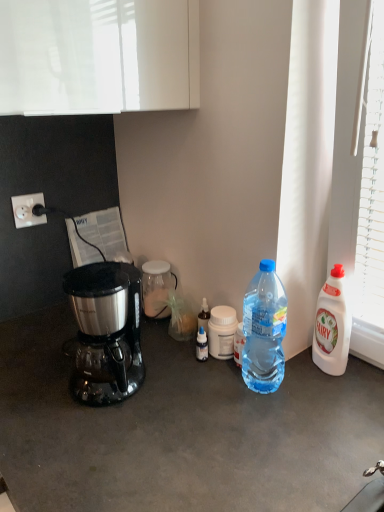
At what (x,y) coordinates should I click in order to perform the action: click on white plastic bottle at center, acting as the second bottle starting from the left. Please return your answer as a coordinate pair (x, y). Looking at the image, I should click on (222, 332).

From the image's perspective, between white plastic power outlet at left and transparent glass jar at center, positioned as the third bottle in right-to-left order, who is located below?

From the image's view, transparent glass jar at center, positioned as the third bottle in right-to-left order, is below.

In the image, is white plastic power outlet at left positioned in front of or behind transparent glass jar at center, the third bottle in the front-to-back sequence?

white plastic power outlet at left is in front of transparent glass jar at center, the third bottle in the front-to-back sequence.

This screenshot has width=384, height=512. Find the location of `the 1st bottle to the right of the white plastic power outlet at left, counting from the anchor's position`. the 1st bottle to the right of the white plastic power outlet at left, counting from the anchor's position is located at coordinates (157, 287).

Which of these two, white plastic bottle at center, acting as the second bottle starting from the left, or transparent glass jar at center, which appears as the 1th bottle when viewed from the left, stands taller?

Standing taller between the two is transparent glass jar at center, which appears as the 1th bottle when viewed from the left.

Is white plastic bottle at center, acting as the second bottle starting from the left, thinner than transparent glass jar at center, the third bottle in the front-to-back sequence?

Correct, the width of white plastic bottle at center, acting as the second bottle starting from the left, is less than that of transparent glass jar at center, the third bottle in the front-to-back sequence.

From the image's perspective, count 2nd bottles downward from the transparent glass jar at center, which appears as the first bottle when viewed from the back, and point to it. Please provide its 2D coordinates.

[(222, 332)]

Considering the sizes of objects white plastic bottle at right, the third bottle viewed from the left, and stainless steel coffee maker at left in the image provided, who is taller, white plastic bottle at right, the third bottle viewed from the left, or stainless steel coffee maker at left?

Standing taller between the two is white plastic bottle at right, the third bottle viewed from the left.

Considering the positions of points (326, 345) and (85, 287), is point (326, 345) farther from camera compared to point (85, 287)?

Yes, it is.

Based on their positions, is white plastic bottle at right, the first bottle in the right-to-left sequence, located to the left or right of stainless steel coffee maker at left?

Based on their positions, white plastic bottle at right, the first bottle in the right-to-left sequence, is located to the right of stainless steel coffee maker at left.

Is white plastic bottle at right, positioned as the first bottle in front-to-back order, spatially inside stainless steel coffee maker at left, or outside of it?

white plastic bottle at right, positioned as the first bottle in front-to-back order, is not enclosed by stainless steel coffee maker at left.

Considering the positions of objects white plastic power outlet at left and white plastic bottle at center, the second bottle when ordered from back to front, in the image provided, who is more to the left, white plastic power outlet at left or white plastic bottle at center, the second bottle when ordered from back to front,?

white plastic power outlet at left.

Looking at this image, which point is more distant from viewer, (30, 225) or (224, 329)?

Positioned behind is point (30, 225).

Considering the relative sizes of white plastic power outlet at left and white plastic bottle at center, the 2th bottle when ordered from right to left, in the image provided, is white plastic power outlet at left thinner than white plastic bottle at center, the 2th bottle when ordered from right to left,?

Correct, the width of white plastic power outlet at left is less than that of white plastic bottle at center, the 2th bottle when ordered from right to left.

Is white plastic power outlet at left in front of or behind white plastic bottle at center, the second bottle when ordered from back to front, in the image?

In the image, white plastic power outlet at left appears behind white plastic bottle at center, the second bottle when ordered from back to front.

Which is more distant, (125, 396) or (27, 217)?

Point (27, 217)

Is stainless steel coffee maker at left taller or shorter than white plastic power outlet at left?

Considering their sizes, stainless steel coffee maker at left has more height than white plastic power outlet at left.

From the image's perspective, is white plastic bottle at center, the second bottle when ordered from back to front, over stainless steel coffee maker at left?

Incorrect, from the image's perspective, white plastic bottle at center, the second bottle when ordered from back to front, is lower than stainless steel coffee maker at left.

Between point (221, 321) and point (89, 321), which one is positioned behind?

The point (221, 321) is farther from the camera.

Considering the sizes of white plastic bottle at center, the 2th bottle when ordered from right to left, and stainless steel coffee maker at left in the image, is white plastic bottle at center, the 2th bottle when ordered from right to left, taller or shorter than stainless steel coffee maker at left?

Considering their sizes, white plastic bottle at center, the 2th bottle when ordered from right to left, has less height than stainless steel coffee maker at left.

Is white plastic bottle at center, the 2th bottle when ordered from right to left, to the right of stainless steel coffee maker at left from the viewer's perspective?

Indeed, white plastic bottle at center, the 2th bottle when ordered from right to left, is positioned on the right side of stainless steel coffee maker at left.

Could white plastic bottle at center, the second bottle when ordered from back to front, be considered to be inside transparent glass jar at center, the third bottle in the front-to-back sequence?

No, transparent glass jar at center, the third bottle in the front-to-back sequence, does not contain white plastic bottle at center, the second bottle when ordered from back to front.

Is transparent glass jar at center, which appears as the first bottle when viewed from the back, at the right side of white plastic bottle at center, the 2th bottle when ordered from right to left?

In fact, transparent glass jar at center, which appears as the first bottle when viewed from the back, is to the left of white plastic bottle at center, the 2th bottle when ordered from right to left.

From the image's perspective, which is above, transparent glass jar at center, the third bottle in the front-to-back sequence, or white plastic bottle at center, positioned as the 2th bottle in front-to-back order?

transparent glass jar at center, the third bottle in the front-to-back sequence.

Considering the relative sizes of transparent glass jar at center, the third bottle in the front-to-back sequence, and white plastic bottle at center, the second bottle when ordered from back to front, in the image provided, is transparent glass jar at center, the third bottle in the front-to-back sequence, smaller than white plastic bottle at center, the second bottle when ordered from back to front,?

No, transparent glass jar at center, the third bottle in the front-to-back sequence, is not smaller than white plastic bottle at center, the second bottle when ordered from back to front.

Identify the location of bottle that is the 2nd object directly below the white plastic power outlet at left (from a real-world perspective). (157, 287).

Locate an element on the screen. The width and height of the screenshot is (384, 512). the 1st bottle in front of the transparent glass jar at center, the third bottle in the front-to-back sequence is located at coordinates (222, 332).

In the scene shown: From the image, which object appears to be farther from white plastic bottle at right, the third bottle viewed from the left, white plastic bottle at center, acting as the second bottle starting from the left, or stainless steel coffee maker at left?

stainless steel coffee maker at left is positioned further to the anchor white plastic bottle at right, the third bottle viewed from the left.

Considering their positions, is white plastic bottle at center, the second bottle when ordered from back to front, positioned further to transparent glass jar at center, the third bottle in the front-to-back sequence, than white plastic bottle at right, positioned as the first bottle in front-to-back order?

white plastic bottle at right, positioned as the first bottle in front-to-back order, lies further to transparent glass jar at center, the third bottle in the front-to-back sequence, than the other object.

Estimate the real-world distances between objects in this image. Which object is closer to transparent glass jar at center, which appears as the first bottle when viewed from the back, white plastic bottle at center, acting as the second bottle starting from the left, or stainless steel coffee maker at left?

white plastic bottle at center, acting as the second bottle starting from the left.

Based on their spatial positions, is white plastic bottle at right, positioned as the first bottle in front-to-back order, or transparent glass jar at center, which appears as the 1th bottle when viewed from the left, further from stainless steel coffee maker at left?

Among the two, white plastic bottle at right, positioned as the first bottle in front-to-back order, is located further to stainless steel coffee maker at left.

Consider the image. From the image, which object appears to be farther from white plastic power outlet at left, white plastic bottle at center, the second bottle when ordered from back to front, or transparent glass jar at center, which appears as the 1th bottle when viewed from the left?

white plastic bottle at center, the second bottle when ordered from back to front, is positioned further to the anchor white plastic power outlet at left.

Based on their spatial positions, is white plastic power outlet at left or stainless steel coffee maker at left further from white plastic bottle at center, acting as the second bottle starting from the left?

white plastic power outlet at left.

Looking at this image, which object lies nearer to the anchor point white plastic bottle at right, the 3th bottle viewed from the back, white plastic power outlet at left or transparent glass jar at center, positioned as the third bottle in right-to-left order?

Based on the image, transparent glass jar at center, positioned as the third bottle in right-to-left order, appears to be nearer to white plastic bottle at right, the 3th bottle viewed from the back.

Which object lies nearer to the anchor point white plastic power outlet at left, transparent glass jar at center, which appears as the first bottle when viewed from the back, or white plastic bottle at right, positioned as the first bottle in front-to-back order?

transparent glass jar at center, which appears as the first bottle when viewed from the back, lies closer to white plastic power outlet at left than the other object.

Where is `coffee maker between white plastic power outlet at left and white plastic bottle at right, the first bottle in the right-to-left sequence, from left to right`? coffee maker between white plastic power outlet at left and white plastic bottle at right, the first bottle in the right-to-left sequence, from left to right is located at coordinates (106, 331).

Where is `bottle located between white plastic power outlet at left and white plastic bottle at center, the second bottle when ordered from back to front, in the left-right direction`? Image resolution: width=384 pixels, height=512 pixels. bottle located between white plastic power outlet at left and white plastic bottle at center, the second bottle when ordered from back to front, in the left-right direction is located at coordinates (157, 287).

Locate an element on the screen. power outlet located between stainless steel coffee maker at left and transparent glass jar at center, which appears as the 1th bottle when viewed from the left, in the depth direction is located at coordinates (27, 210).

At what (x,y) coordinates should I click in order to perform the action: click on bottle located between transparent glass jar at center, which appears as the 1th bottle when viewed from the left, and white plastic bottle at right, the third bottle viewed from the left, in the left-right direction. Please return your answer as a coordinate pair (x, y). This screenshot has width=384, height=512. Looking at the image, I should click on (222, 332).